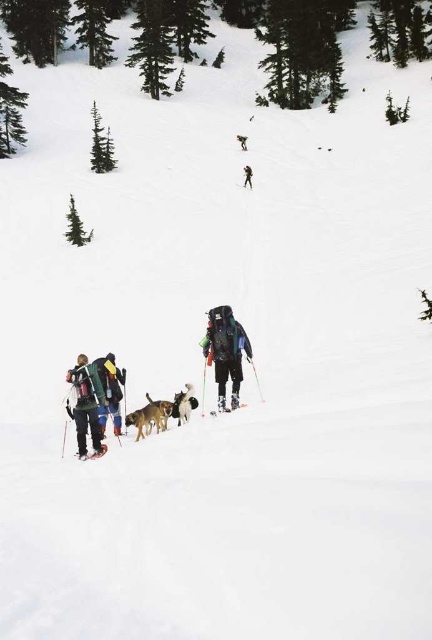
Question: Which of these objects is positioned closest to the green fabric backpack at upper center?

Choices:
 (A) matte black backpack at left
 (B) shiny metallic ski at center
 (C) shiny metallic ski at lower left

Answer: (B)

Question: Among these objects, which one is farthest from the camera?

Choices:
 (A) matte black backpack at left
 (B) shiny metallic ski at center
 (C) black ski suit at upper center
 (D) brown fur dog at center

Answer: (C)

Question: Is green fabric backpack at upper center bigger than shiny metallic ski at upper center?

Choices:
 (A) no
 (B) yes

Answer: (A)

Question: Is brown fur dog at center further to camera compared to green fabric backpack at upper center?

Choices:
 (A) no
 (B) yes

Answer: (A)

Question: Which object appears farthest from the camera in this image?

Choices:
 (A) black ski suit at upper center
 (B) shiny metallic ski at upper center

Answer: (B)

Question: Is matte black backpack at left wider than green fabric backpack at upper center?

Choices:
 (A) no
 (B) yes

Answer: (B)